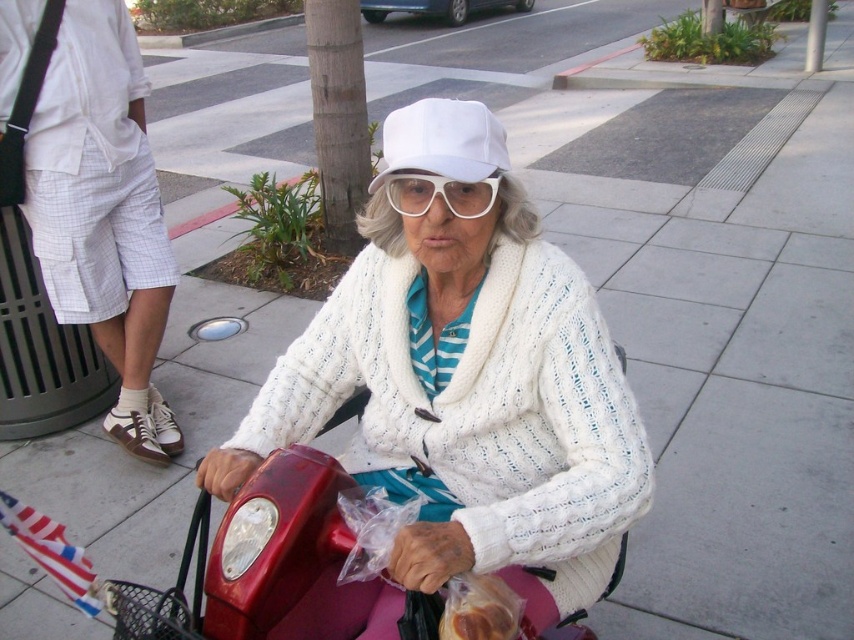
Question: Is white knitted sweater at center to the left of white fabric baseball cap at center from the viewer's perspective?

Choices:
 (A) no
 (B) yes

Answer: (A)

Question: Can you confirm if white glossy bread at lower center is positioned to the left of white plastic goggles at center?

Choices:
 (A) yes
 (B) no

Answer: (B)

Question: Among these objects, which one is nearest to the camera?

Choices:
 (A) white fabric baseball cap at center
 (B) white plastic goggles at center
 (C) white knitted sweater at center
 (D) white glossy bread at lower center

Answer: (C)

Question: Which point is closer to the camera?

Choices:
 (A) white fabric baseball cap at center
 (B) white plastic goggles at center
 (C) white knitted sweater at center
 (D) white glossy bread at lower center

Answer: (C)

Question: Is white fabric baseball cap at center wider than white glossy bread at lower center?

Choices:
 (A) yes
 (B) no

Answer: (A)

Question: Which object is closer to the camera taking this photo?

Choices:
 (A) white glossy bread at lower center
 (B) white knitted sweater at center
 (C) white fabric baseball cap at center

Answer: (B)